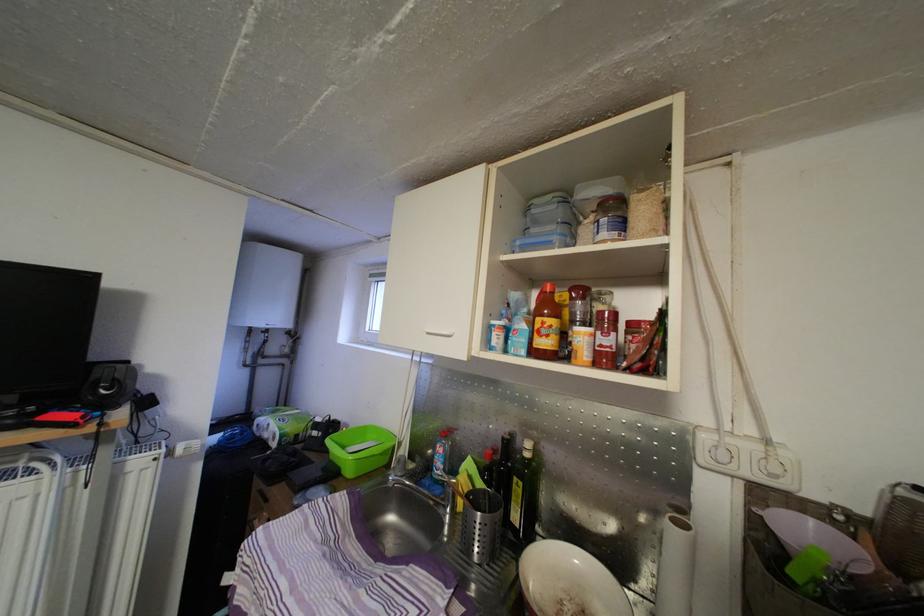
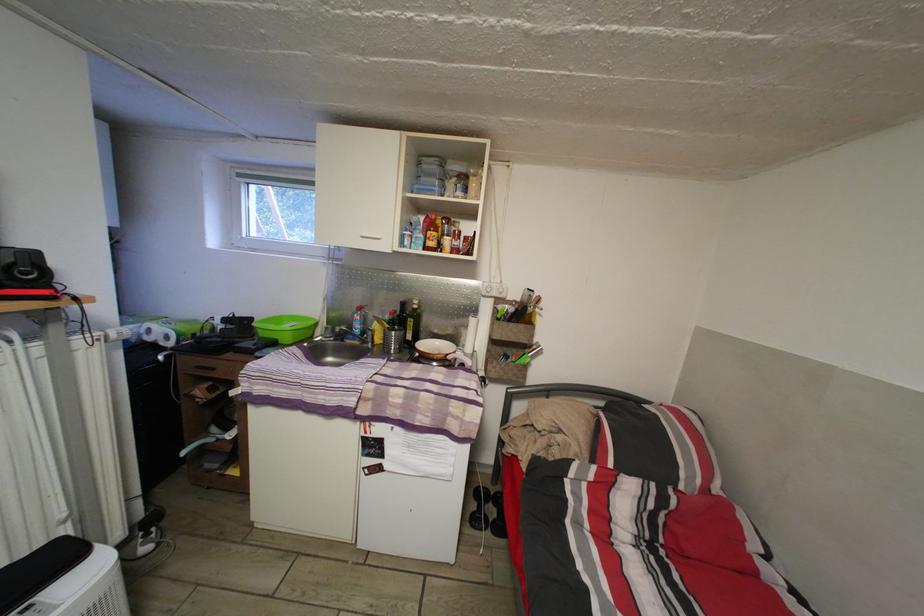
Where in the second image is the point corresponding to (525,493) from the first image?

(418, 329)